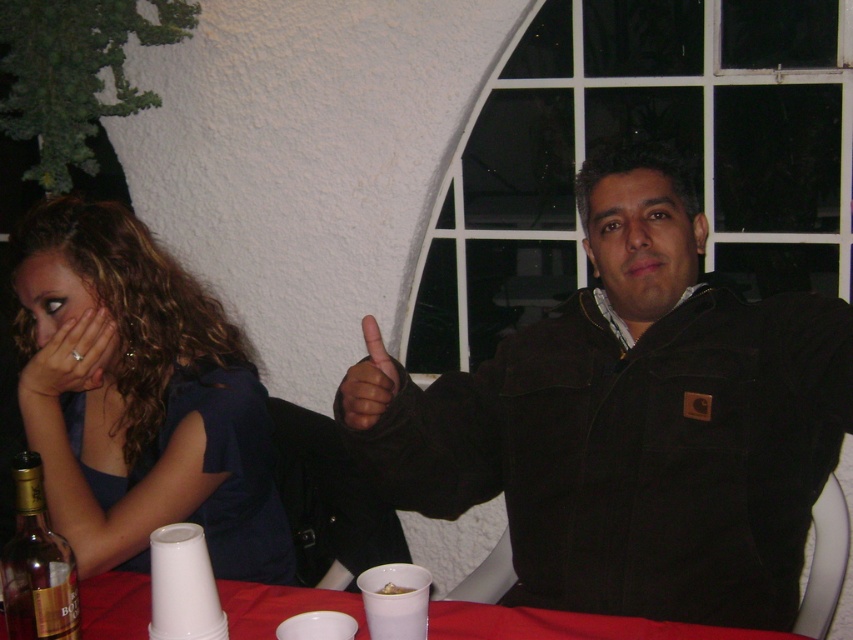
Image resolution: width=853 pixels, height=640 pixels. Find the location of `smooth plastic cups at lower center`. smooth plastic cups at lower center is located at coordinates (567, 625).

Locate an element on the screen. Image resolution: width=853 pixels, height=640 pixels. smooth plastic cups at lower center is located at coordinates (567, 625).

Where is `smooth plastic cups at lower center`? The width and height of the screenshot is (853, 640). smooth plastic cups at lower center is located at coordinates (567, 625).

Is point (68, 296) positioned behind point (114, 324)?

That is False.

What do you see at coordinates (140, 397) in the screenshot?
I see `matte blue dress at left` at bounding box center [140, 397].

Is point (108, 284) more distant than point (97, 355)?

Yes.

You are a GUI agent. You are given a task and a screenshot of the screen. Output one action in this format:
    pyautogui.click(x=<x>, y=<y>)
    Task: Click on the matte blue dress at left
    Image resolution: width=853 pixels, height=640 pixels.
    Given the screenshot: What is the action you would take?
    pyautogui.click(x=140, y=397)

Can you confirm if black corduroy jacket at center is positioned to the left of matte black hand at lower left?

Incorrect, black corduroy jacket at center is not on the left side of matte black hand at lower left.

Is black corduroy jacket at center shorter than matte black hand at lower left?

No.

Where is `black corduroy jacket at center`? The height and width of the screenshot is (640, 853). black corduroy jacket at center is located at coordinates (630, 420).